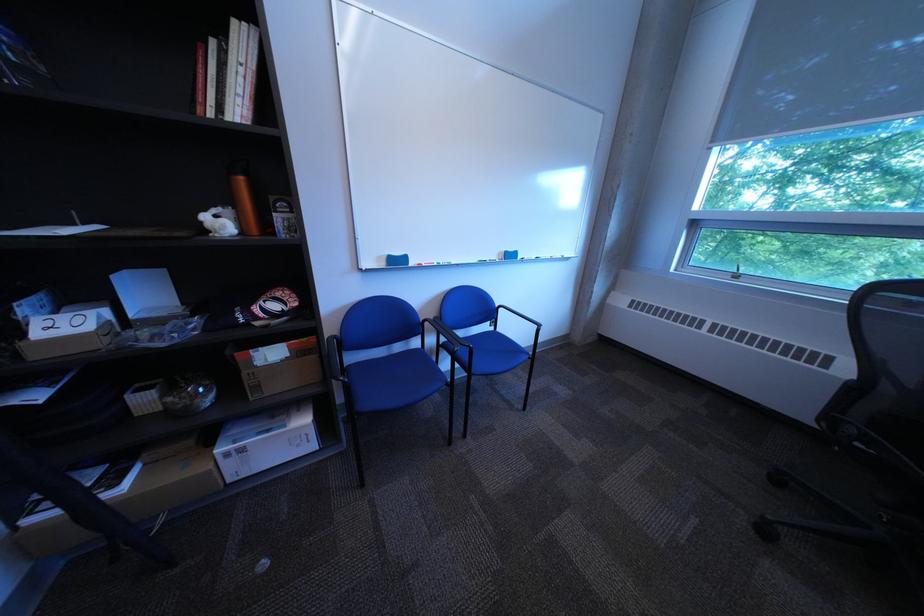
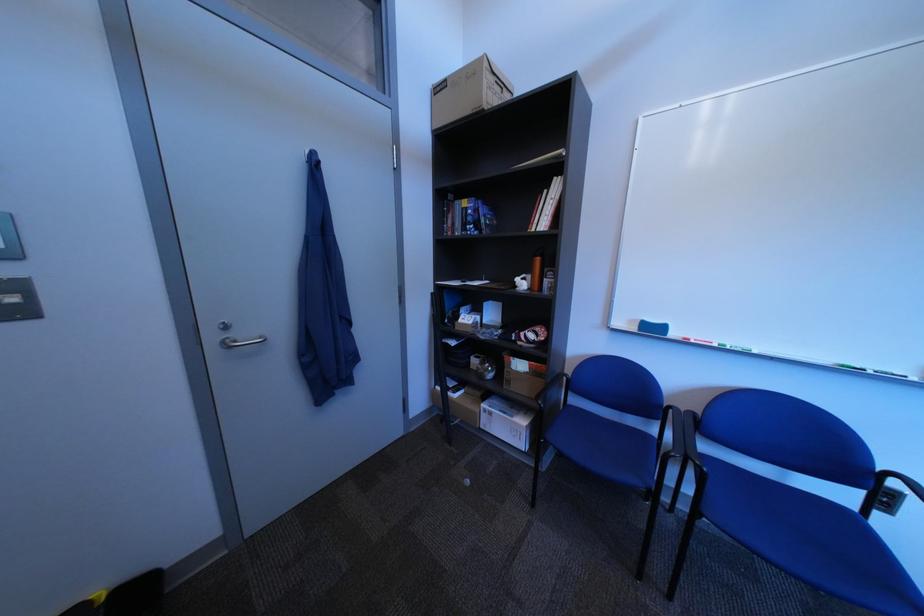
Find the pixel in the second image that matches (x=442, y=325) in the first image.

(687, 413)